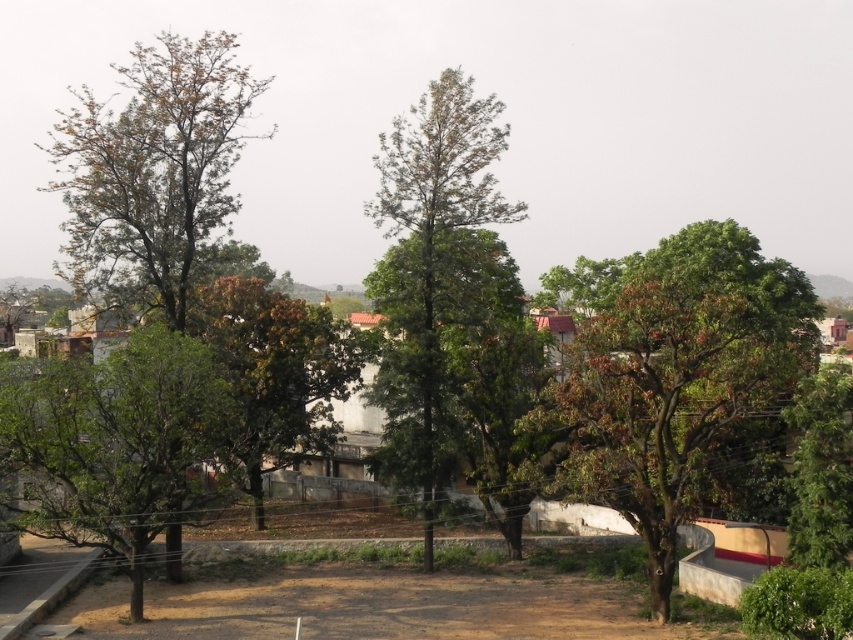
Based on the photo, you are planning to plant a new tree in this outdoor area. The green leafy tree at right and the brown textured tree at center are already present. Which existing tree should you consider for shade if you want a taller tree to provide more coverage?

The green leafy tree at right is taller than the brown textured tree at center, so it would provide more shade coverage.

You are planning to plant a new tree in this outdoor area. You have two options based on the existing trees shown. Which tree, the green leafy tree at right or the brown textured tree at left, would you choose if you want a tree with a narrower width for the space?

The green leafy tree at right has a lesser width compared to the brown textured tree at left, so it would be the better choice for a narrower tree in the space.

You are planning to plant a new tree in this outdoor area. The green leafy tree at right and the brown textured tree at left are already present. Based on their sizes, which tree would require more space for its root system?

The brown textured tree at left requires more space for its root system because it is larger in size compared to the green leafy tree at right.